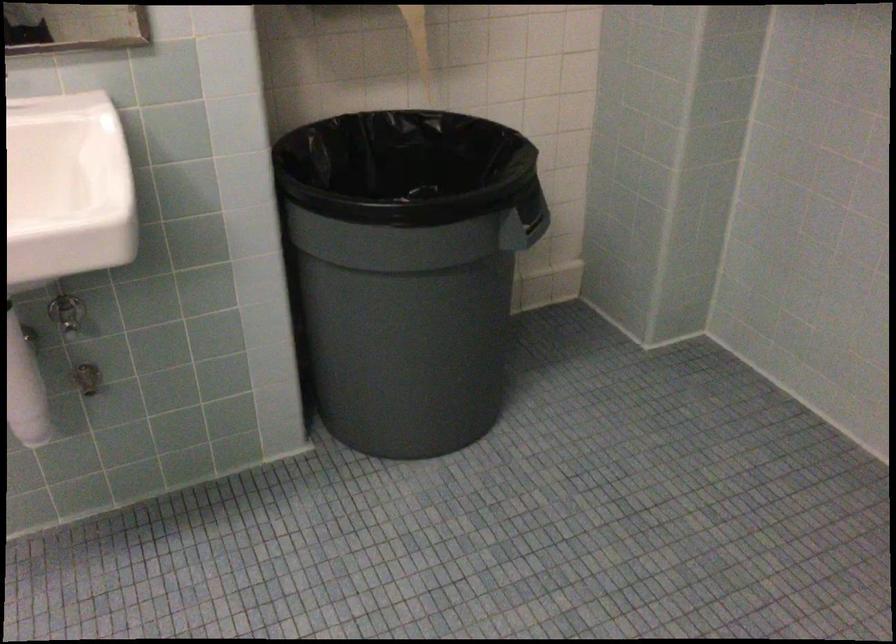
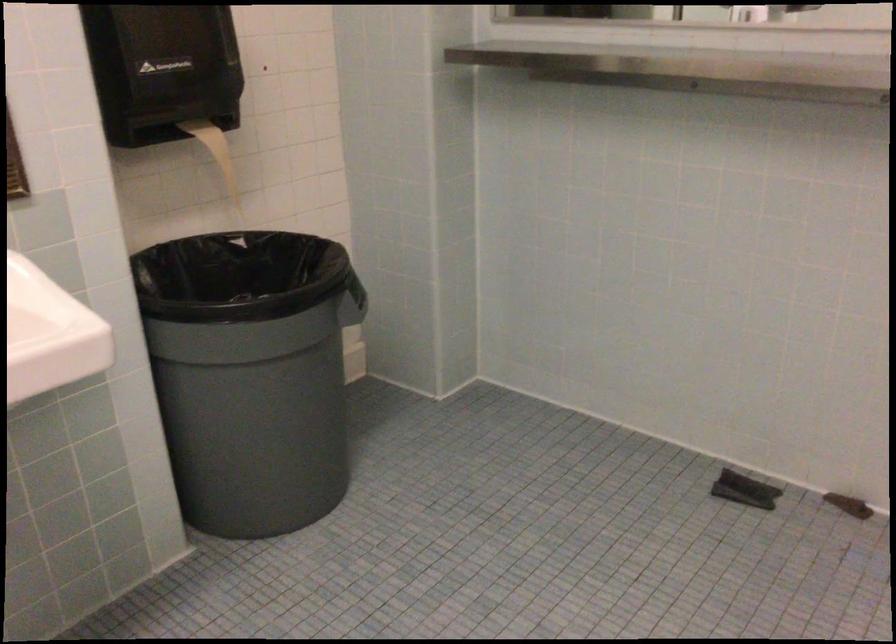
Where in the second image is the point corresponding to point (419, 152) from the first image?

(228, 266)